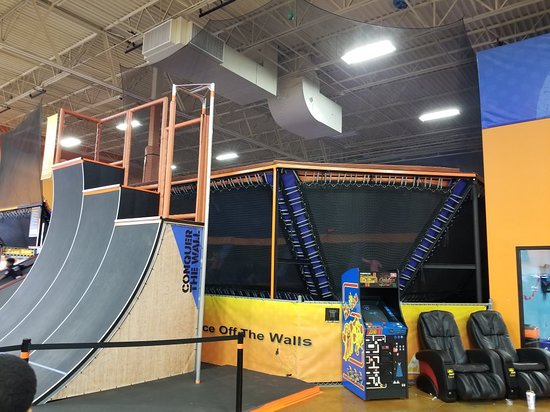
I want to click on chair seat, so click(x=470, y=366).